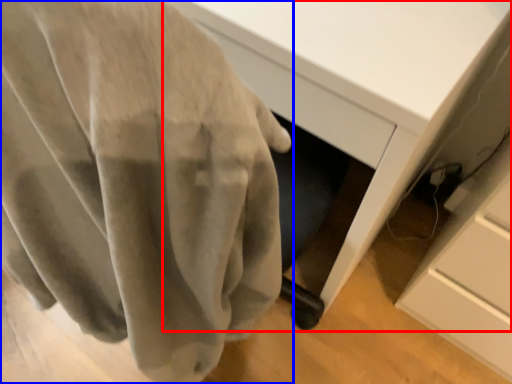
Question: Which object is closer to the camera taking this photo, desk (highlighted by a red box) or curtain (highlighted by a blue box)?

Choices:
 (A) desk
 (B) curtain

Answer: (B)